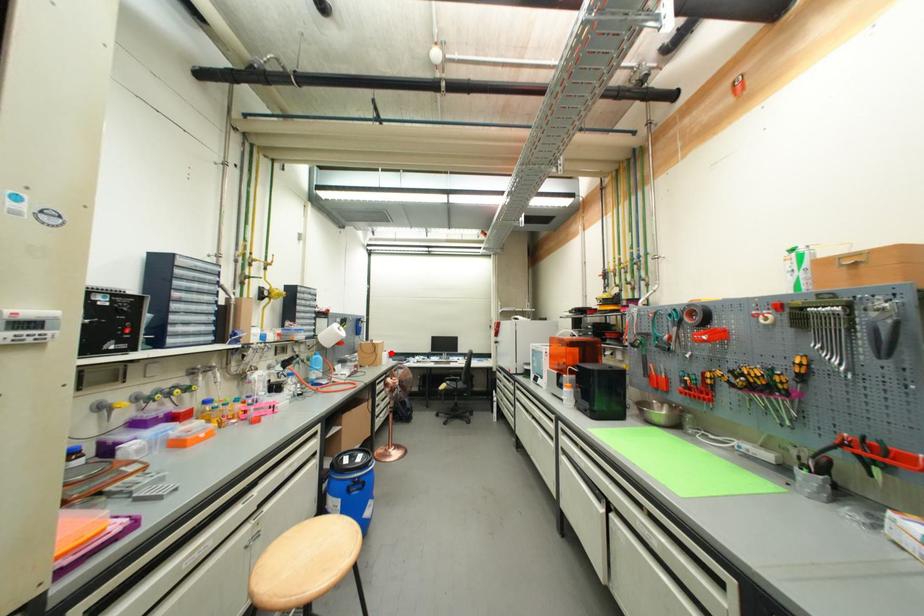
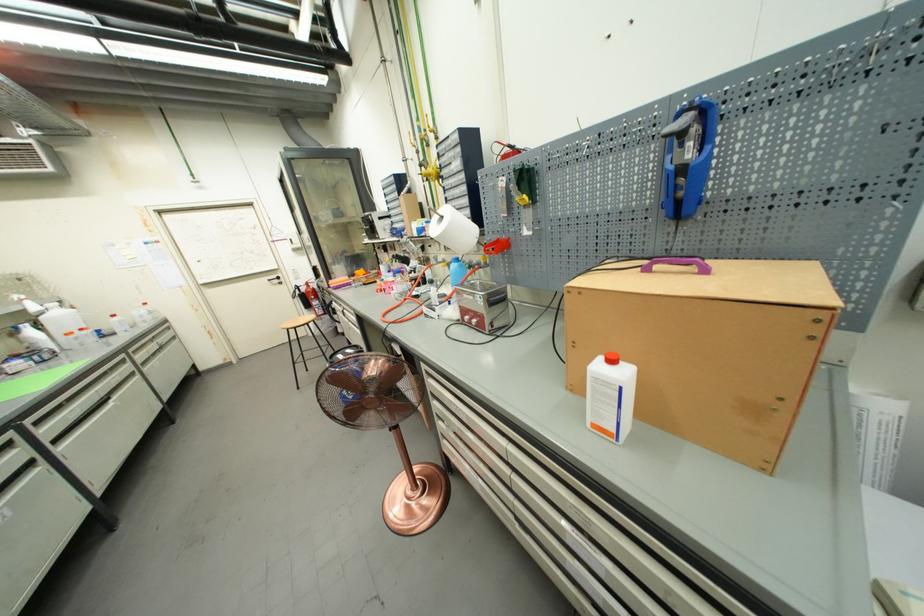
In the second image, find the point that corresponds to the highlighted location in the first image.

(617, 363)